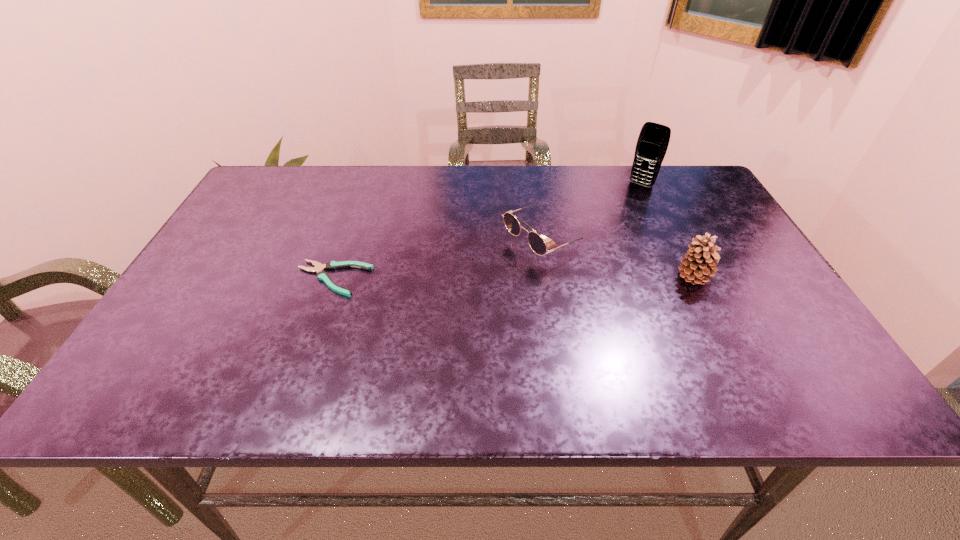
At what (x,y) coordinates should I click in order to perform the action: click on free space at the near edge of the desktop. Please return your answer as a coordinate pair (x, y). This screenshot has height=540, width=960. Looking at the image, I should click on (374, 362).

Identify the location of blank area at the left edge. This screenshot has height=540, width=960. (216, 293).

You are a GUI agent. You are given a task and a screenshot of the screen. Output one action in this format:
    pyautogui.click(x=<x>, y=<y>)
    Task: Click on the free spot at the right edge of the desktop
    This screenshot has height=540, width=960.
    Given the screenshot: What is the action you would take?
    pyautogui.click(x=750, y=305)

Locate an element on the screen. The image size is (960, 540). vacant space at the far left corner is located at coordinates (309, 181).

Find the location of a particular element. vacant space at the far right corner of the desktop is located at coordinates [x=712, y=201].

Where is `free region at the near right corner of the desktop`? free region at the near right corner of the desktop is located at coordinates (730, 341).

Identify the location of vacant region between the pliers and the farthest object. (487, 232).

This screenshot has width=960, height=540. I want to click on free spot between the farthest object and the sunglasses, so click(x=593, y=212).

At what (x,y) coordinates should I click in order to perform the action: click on vacant space that's between the shortest object and the pinecone. Please return your answer as a coordinate pair (x, y). The width and height of the screenshot is (960, 540). Looking at the image, I should click on (514, 278).

This screenshot has height=540, width=960. Identify the location of free spot between the second shortest object and the pinecone. (619, 259).